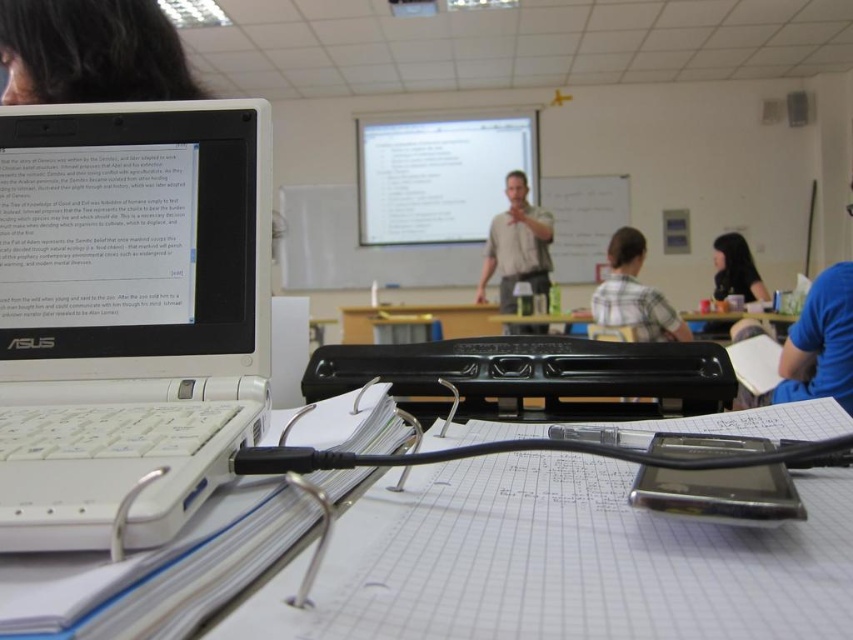
Is the position of plaid shirt at center more distant than that of black hair at upper right?

No, it is not.

Which is in front, point (604, 289) or point (747, 259)?

Point (604, 289) is in front.

I want to click on plaid shirt at center, so click(x=633, y=294).

Is white plastic table at center shorter than plaid shirt at center?

Indeed, white plastic table at center has a lesser height compared to plaid shirt at center.

Is white plastic table at center to the right of plaid shirt at center from the viewer's perspective?

Incorrect, white plastic table at center is not on the right side of plaid shirt at center.

This screenshot has height=640, width=853. In order to click on white plastic table at center in this screenshot , I will do `click(155, 572)`.

Can you confirm if white plastic laptop at left is thinner than light beige shirt at center?

Correct, white plastic laptop at left's width is less than light beige shirt at center's.

How distant is white plastic laptop at left from light beige shirt at center?

A distance of 3.34 meters exists between white plastic laptop at left and light beige shirt at center.

At what (x,y) coordinates should I click in order to perform the action: click on white plastic laptop at left. Please return your answer as a coordinate pair (x, y). This screenshot has width=853, height=640. Looking at the image, I should click on (128, 314).

The width and height of the screenshot is (853, 640). Find the location of `white plastic laptop at left`. white plastic laptop at left is located at coordinates (128, 314).